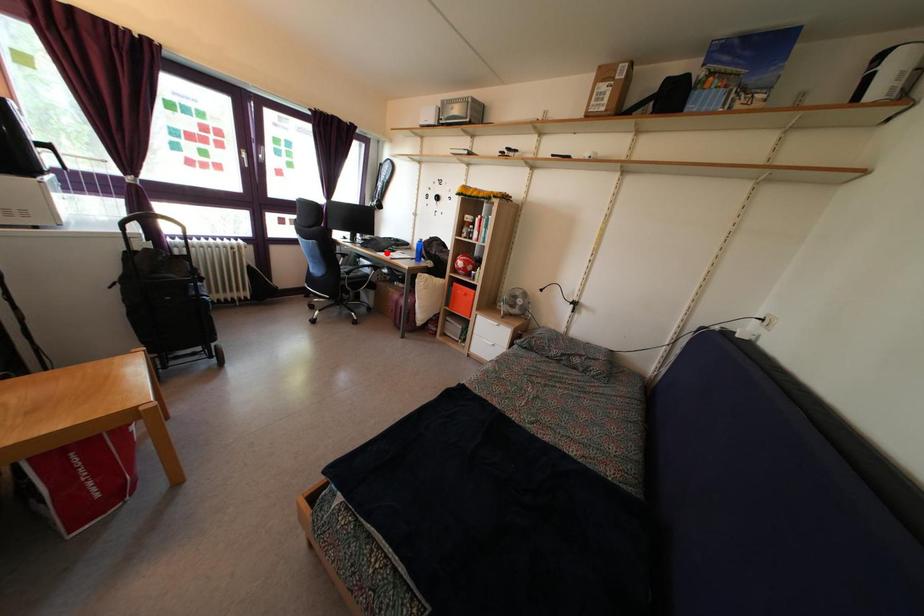
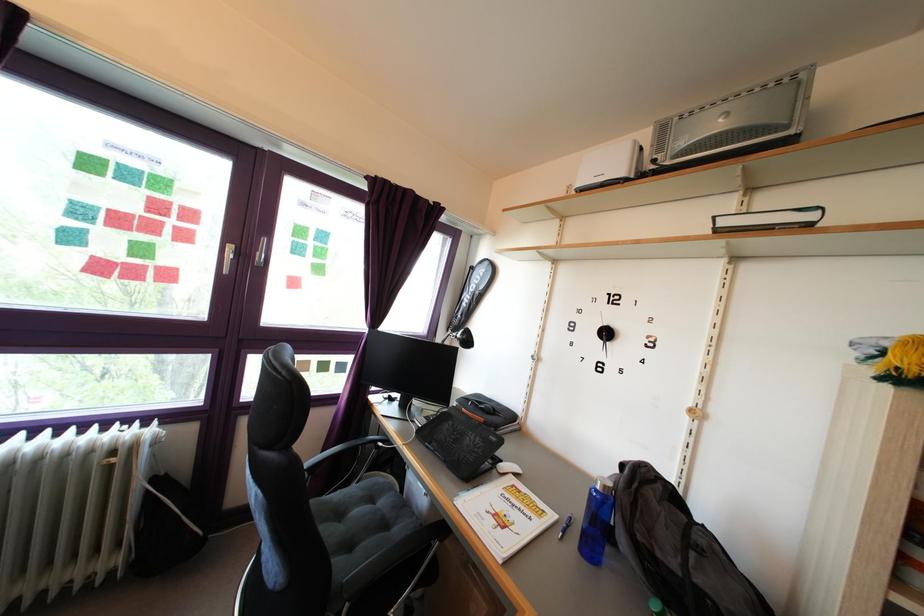
Question: A red point is marked in image1. In image2, is the corresponding 3D point closer to the camera or farther? Reply with the corresponding letter.

Choices:
 (A) The corresponding 3D point is closer.
 (B) The corresponding 3D point is farther.

Answer: (B)